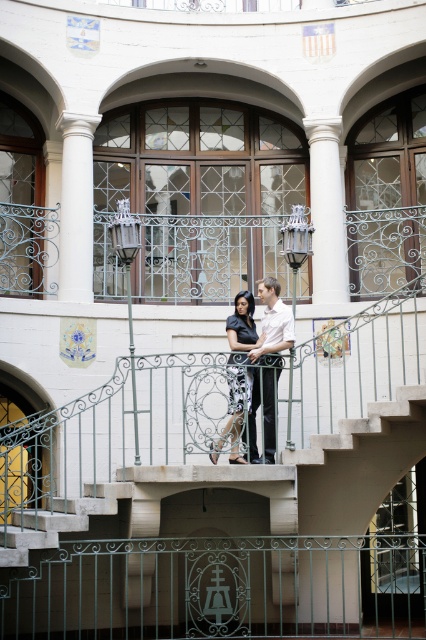
Question: Is white glossy shirt at center thinner than matte black dress at center?

Choices:
 (A) yes
 (B) no

Answer: (A)

Question: Does green wrought iron railing at center lie in front of matte black dress at center?

Choices:
 (A) yes
 (B) no

Answer: (A)

Question: Based on their relative distances, which object is farther from the matte black dress at center?

Choices:
 (A) green wrought iron railing at center
 (B) white glossy shirt at center

Answer: (A)

Question: Estimate the real-world distances between objects in this image. Which object is farther from the white glossy shirt at center?

Choices:
 (A) matte black dress at center
 (B) green wrought iron railing at center

Answer: (B)

Question: Among these points, which one is nearest to the camera?

Choices:
 (A) (192, 609)
 (B) (239, 394)

Answer: (B)

Question: Where is green wrought iron railing at center located in relation to white glossy shirt at center in the image?

Choices:
 (A) below
 (B) above

Answer: (A)